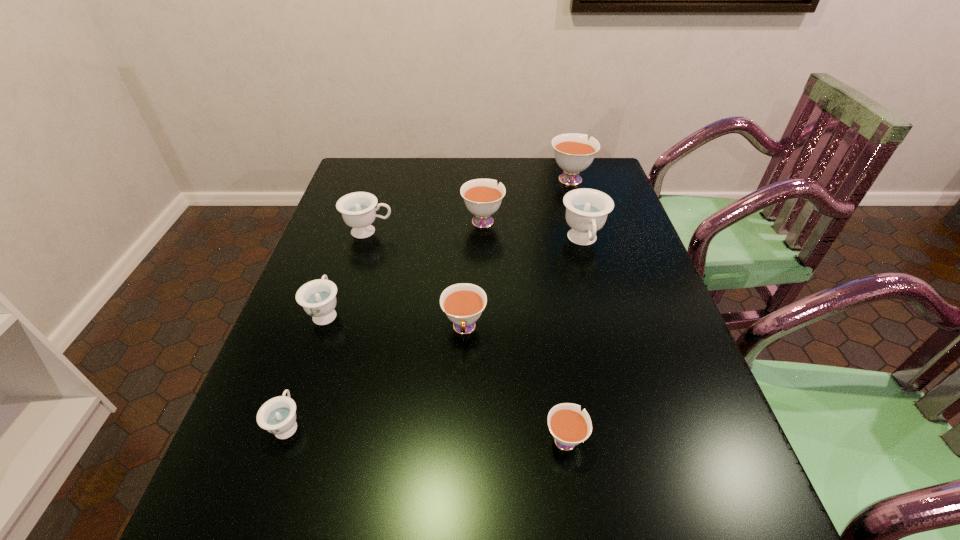
Locate an element on the screen. blank region between the smallest blue teacup and the second farthest white teacup is located at coordinates (385, 322).

Locate an element on the screen. free space between the second biggest blue teacup and the sixth teacup from left to right is located at coordinates (467, 335).

Locate an element on the screen. The height and width of the screenshot is (540, 960). object that is the sixth nearest to the smallest blue teacup is located at coordinates (586, 209).

At what (x,y) coordinates should I click in order to perform the action: click on object that can be found as the fifth closest to the second smallest blue teacup. Please return your answer as a coordinate pair (x, y). This screenshot has height=540, width=960. Looking at the image, I should click on 569,426.

You are a GUI agent. You are given a task and a screenshot of the screen. Output one action in this format:
    pyautogui.click(x=<x>, y=<y>)
    Task: Click on the teacup that is the fourth closest to the third smallest blue teacup
    The height and width of the screenshot is (540, 960).
    Given the screenshot: What is the action you would take?
    pyautogui.click(x=586, y=209)

Where is `teacup that stands as the fourth closest to the third smallest blue teacup`? This screenshot has height=540, width=960. teacup that stands as the fourth closest to the third smallest blue teacup is located at coordinates (586, 209).

Select which white teacup appears as the second closest to the third object from right to left. Please provide its 2D coordinates. Your answer should be formatted as a tuple, i.e. [(x, y)], where the tuple contains the x and y coordinates of a point satisfying the conditions above.

[(482, 197)]

This screenshot has height=540, width=960. Identify the location of white teacup that is the third nearest to the nearest blue teacup. (482, 197).

Select which blue teacup appears as the closest to the second biggest blue teacup. Please provide its 2D coordinates. Your answer should be formatted as a tuple, i.e. [(x, y)], where the tuple contains the x and y coordinates of a point satisfying the conditions above.

[(318, 297)]

This screenshot has width=960, height=540. Find the location of `blue teacup that is the closest one to the farthest teacup`. blue teacup that is the closest one to the farthest teacup is located at coordinates (586, 209).